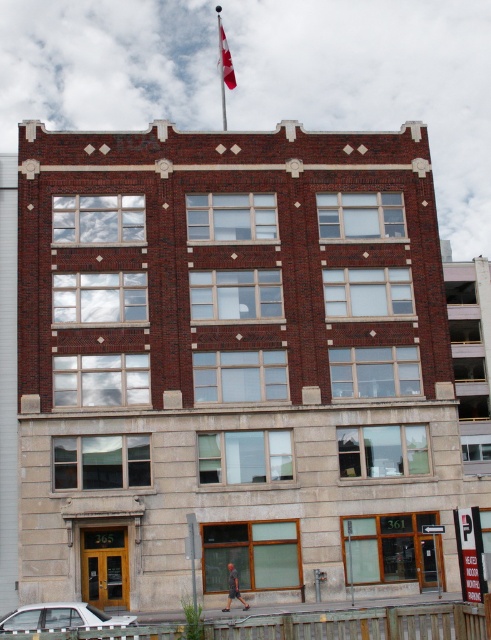
Question: Can you confirm if white matte sedan at lower left is positioned to the left of red fabric flag at upper center?

Choices:
 (A) no
 (B) yes

Answer: (B)

Question: Among these points, which one is farthest from the camera?

Choices:
 (A) (224, 83)
 (B) (218, 28)
 (C) (87, 624)

Answer: (B)

Question: Is metallic flag pole at upper center in front of red fabric flag at upper center?

Choices:
 (A) no
 (B) yes

Answer: (B)

Question: Which object is positioned farthest from the white matte sedan at lower left?

Choices:
 (A) red fabric flag at upper center
 (B) metallic flag pole at upper center

Answer: (A)

Question: Which object is closer to the camera taking this photo?

Choices:
 (A) white matte sedan at lower left
 (B) red fabric flag at upper center
 (C) metallic flag pole at upper center

Answer: (A)

Question: Considering the relative positions of white matte sedan at lower left and red fabric flag at upper center in the image provided, where is white matte sedan at lower left located with respect to red fabric flag at upper center?

Choices:
 (A) above
 (B) below

Answer: (B)